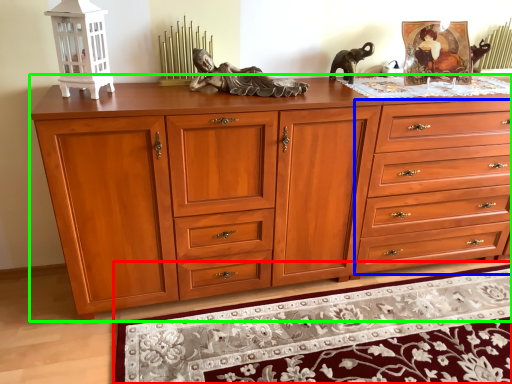
Question: Which object is positioned closest to mat (highlighted by a red box)? Select from drawer (highlighted by a blue box) and chest of drawers (highlighted by a green box).

Choices:
 (A) drawer
 (B) chest of drawers

Answer: (B)